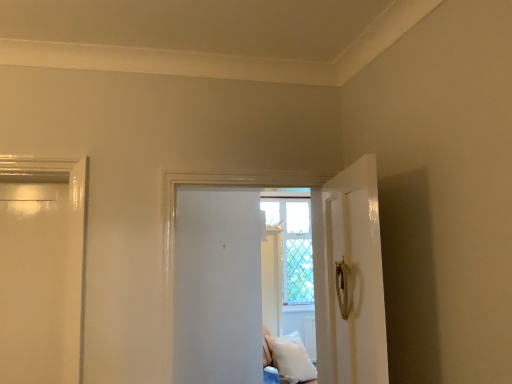
Question: Is white matte door at center far away from white soft pillow at lower center?

Choices:
 (A) yes
 (B) no

Answer: (A)

Question: Is white matte door at center smaller than white soft pillow at lower center?

Choices:
 (A) no
 (B) yes

Answer: (A)

Question: Can you confirm if white matte door at center is wider than white soft pillow at lower center?

Choices:
 (A) no
 (B) yes

Answer: (A)

Question: Is white matte door at center shorter than white soft pillow at lower center?

Choices:
 (A) no
 (B) yes

Answer: (A)

Question: Is white matte door at center bigger than white soft pillow at lower center?

Choices:
 (A) yes
 (B) no

Answer: (A)

Question: Does white matte door at center appear on the left side of white soft pillow at lower center?

Choices:
 (A) no
 (B) yes

Answer: (B)

Question: Could you tell me if white matte door at center is facing clear glass window at center?

Choices:
 (A) no
 (B) yes

Answer: (B)

Question: Can you confirm if white matte door at center is wider than clear glass window at center?

Choices:
 (A) no
 (B) yes

Answer: (B)

Question: Is white matte door at center at the right side of clear glass window at center?

Choices:
 (A) no
 (B) yes

Answer: (A)

Question: Can you confirm if white matte door at center is smaller than clear glass window at center?

Choices:
 (A) yes
 (B) no

Answer: (B)

Question: From the image's perspective, is white matte door at center over clear glass window at center?

Choices:
 (A) yes
 (B) no

Answer: (A)

Question: Considering the relative sizes of white matte door at center and clear glass window at center in the image provided, is white matte door at center shorter than clear glass window at center?

Choices:
 (A) no
 (B) yes

Answer: (B)

Question: Does white soft pillow at lower center have a larger size compared to white matte door at center?

Choices:
 (A) no
 (B) yes

Answer: (A)